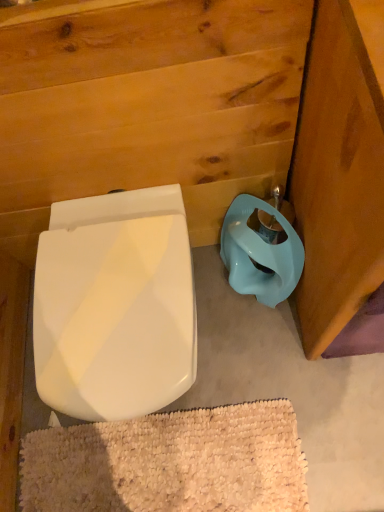
Question: Can you confirm if white textured bath mat at lower center is wider than white glossy toilet seat at lower left?

Choices:
 (A) yes
 (B) no

Answer: (B)

Question: Considering the relative positions of white textured bath mat at lower center and white glossy toilet seat at lower left in the image provided, is white textured bath mat at lower center to the left of white glossy toilet seat at lower left from the viewer's perspective?

Choices:
 (A) no
 (B) yes

Answer: (A)

Question: Is white textured bath mat at lower center taller than white glossy toilet seat at lower left?

Choices:
 (A) yes
 (B) no

Answer: (B)

Question: Is white textured bath mat at lower center oriented away from white glossy toilet seat at lower left?

Choices:
 (A) no
 (B) yes

Answer: (A)

Question: Is white textured bath mat at lower center in contact with white glossy toilet seat at lower left?

Choices:
 (A) no
 (B) yes

Answer: (A)

Question: Is white textured bath mat at lower center thinner than white glossy toilet seat at lower left?

Choices:
 (A) yes
 (B) no

Answer: (A)

Question: Is the position of white textured bath mat at lower center less distant than that of matte blue plastic toilet bowl at lower right?

Choices:
 (A) no
 (B) yes

Answer: (A)

Question: Does white textured bath mat at lower center appear on the left side of matte blue plastic toilet bowl at lower right?

Choices:
 (A) no
 (B) yes

Answer: (B)

Question: Is white textured bath mat at lower center far from matte blue plastic toilet bowl at lower right?

Choices:
 (A) no
 (B) yes

Answer: (A)

Question: Is white textured bath mat at lower center located outside matte blue plastic toilet bowl at lower right?

Choices:
 (A) no
 (B) yes

Answer: (B)

Question: From the image's perspective, is white textured bath mat at lower center located above matte blue plastic toilet bowl at lower right?

Choices:
 (A) yes
 (B) no

Answer: (B)

Question: Does white textured bath mat at lower center have a smaller size compared to matte blue plastic toilet bowl at lower right?

Choices:
 (A) no
 (B) yes

Answer: (B)

Question: Is white glossy toilet seat at lower left thinner than white textured bath mat at lower center?

Choices:
 (A) yes
 (B) no

Answer: (B)